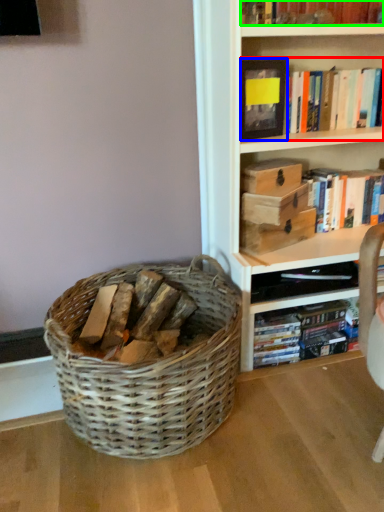
Question: Considering the real-world distances, which object is closest to book (highlighted by a red box)? paperback book (highlighted by a blue box) or book (highlighted by a green box).

Choices:
 (A) paperback book
 (B) book

Answer: (A)